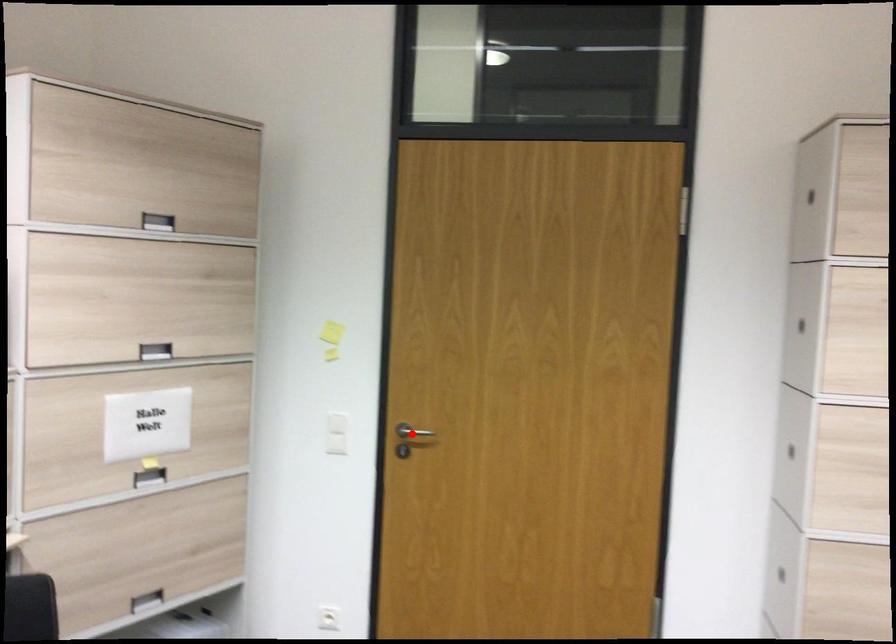
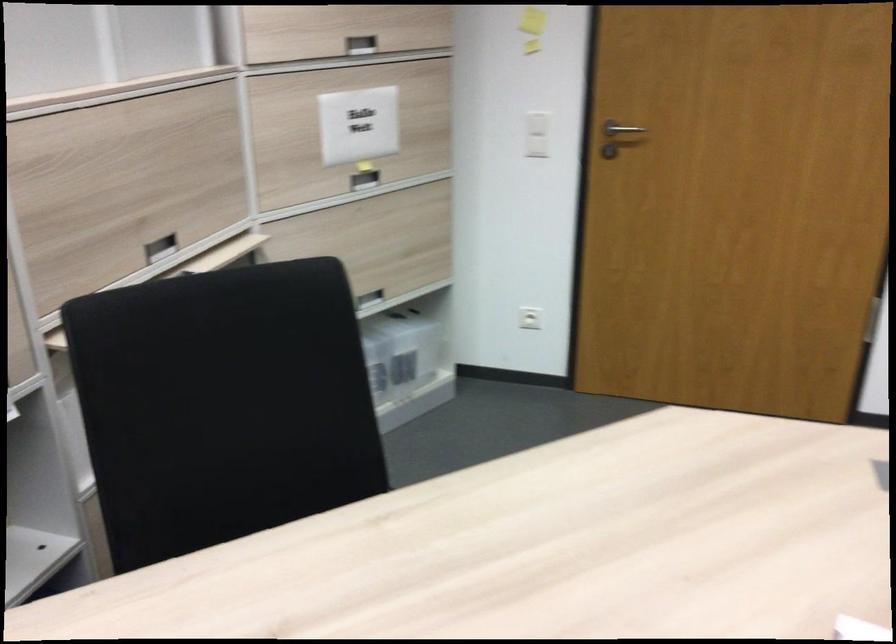
Locate, in the second image, the point that corresponds to the highlighted location in the first image.

(619, 129)